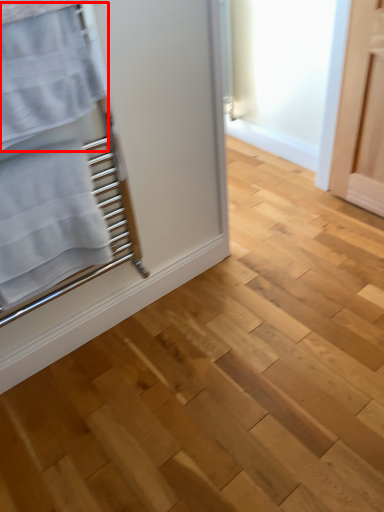
Question: Considering the relative positions of bath towel (annotated by the red box) and bath towel in the image provided, where is bath towel (annotated by the red box) located with respect to the staircase?

Choices:
 (A) right
 (B) left

Answer: (A)